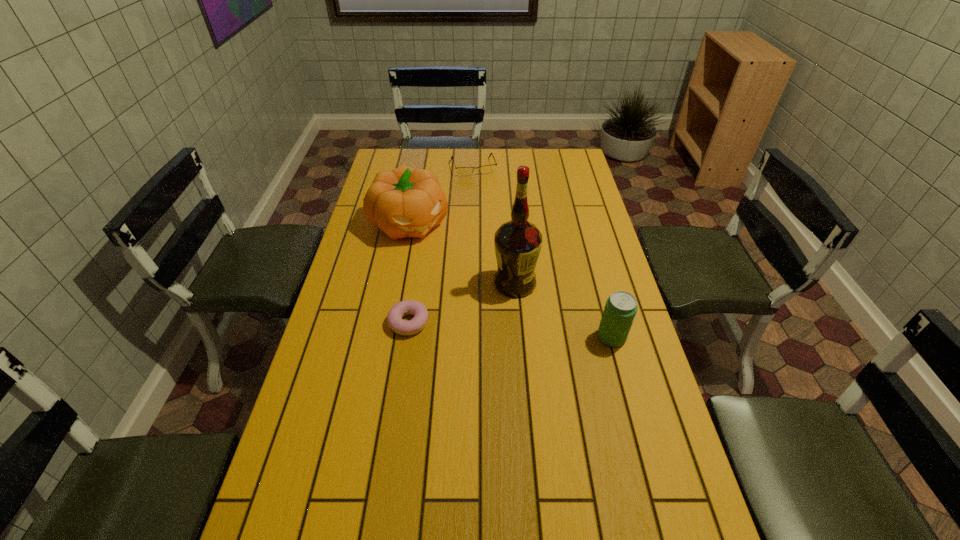
At what (x,y) coordinates should I click in order to perform the action: click on vacant space located 0.100m on the carved face of the fourth nearest object. Please return your answer as a coordinate pair (x, y). The height and width of the screenshot is (540, 960). Looking at the image, I should click on (442, 260).

Image resolution: width=960 pixels, height=540 pixels. I want to click on vacant area situated on the carved face of the fourth nearest object, so click(454, 275).

Where is `vacant area situated 0.300m on the carved face of the fourth nearest object`? vacant area situated 0.300m on the carved face of the fourth nearest object is located at coordinates (471, 296).

Find the location of a particular element. vacant space located on the front-facing side of the spectacles is located at coordinates (x=484, y=195).

Where is `free space located 0.210m on the front-facing side of the spectacles`? This screenshot has height=540, width=960. free space located 0.210m on the front-facing side of the spectacles is located at coordinates (487, 205).

You are a GUI agent. You are given a task and a screenshot of the screen. Output one action in this format:
    pyautogui.click(x=<x>, y=<y>)
    Task: Click on the vacant space located 0.150m on the front-facing side of the spectacles
    This screenshot has height=540, width=960.
    Given the screenshot: What is the action you would take?
    pyautogui.click(x=484, y=196)

I want to click on free space located on the label of the third farthest object, so click(x=526, y=314).

Image resolution: width=960 pixels, height=540 pixels. What are the coordinates of `blank area located on the label of the third farthest object` in the screenshot? It's located at (544, 366).

The height and width of the screenshot is (540, 960). Find the location of `vacant space located on the label of the third farthest object`. vacant space located on the label of the third farthest object is located at coordinates (537, 345).

Find the location of a particular element. This screenshot has height=540, width=960. object at the far edge is located at coordinates (487, 169).